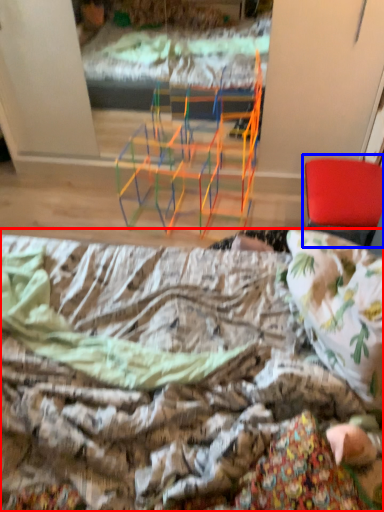
Question: Which object is further to the camera taking this photo, bed (highlighted by a red box) or chair (highlighted by a blue box)?

Choices:
 (A) bed
 (B) chair

Answer: (B)